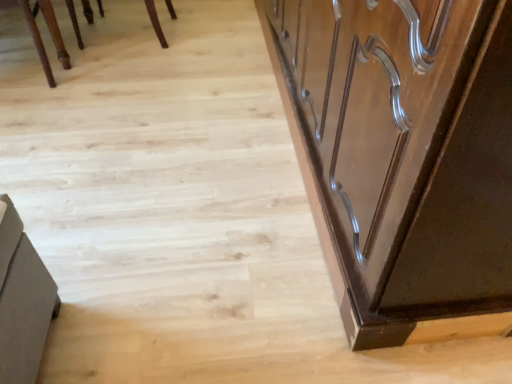
You are a GUI agent. You are given a task and a screenshot of the screen. Output one action in this format:
    pyautogui.click(x=<x>, y=<y>)
    Task: Click on the free area below brown wood chair leg at upper left (from a real-world perspective)
    The height and width of the screenshot is (384, 512).
    Given the screenshot: What is the action you would take?
    pyautogui.click(x=21, y=71)